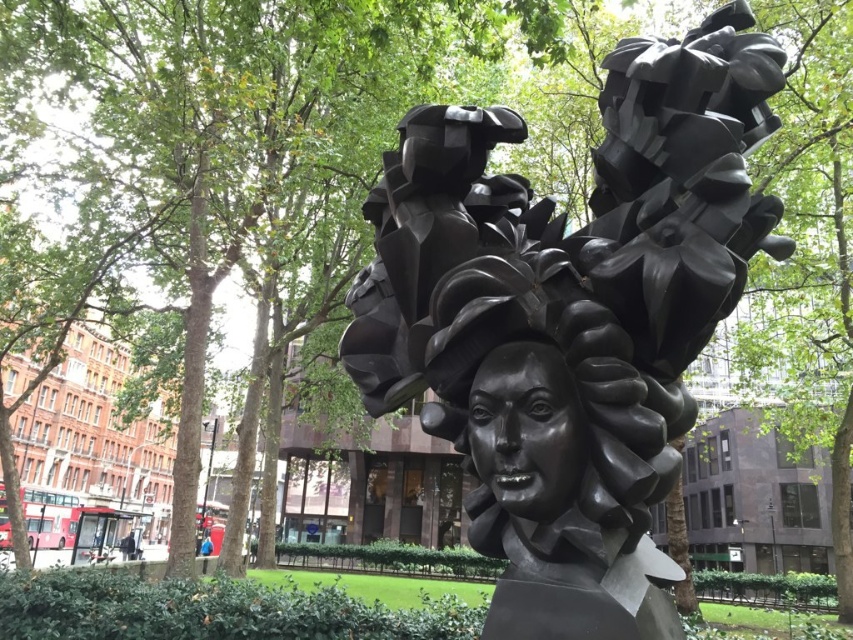
Which is more to the right, polished bronze bust at center or shiny black bust at center?

Positioned to the right is polished bronze bust at center.

The width and height of the screenshot is (853, 640). What do you see at coordinates (572, 317) in the screenshot?
I see `polished bronze bust at center` at bounding box center [572, 317].

Find the location of a particular element. polished bronze bust at center is located at coordinates (572, 317).